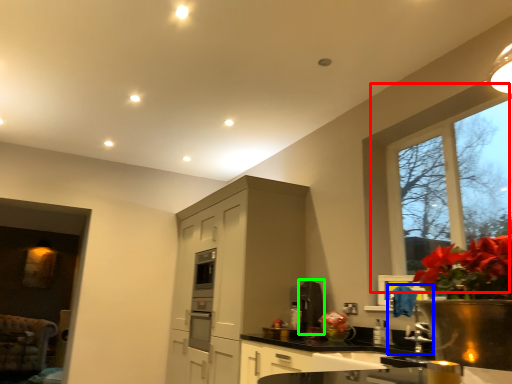
Question: Which is farther away from window (highlighted by a red box)? faucet (highlighted by a blue box) or appliance (highlighted by a green box)?

Choices:
 (A) faucet
 (B) appliance

Answer: (B)